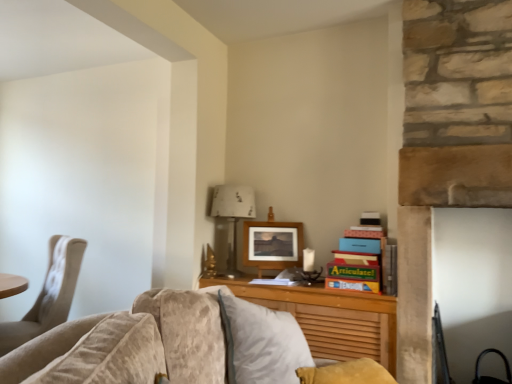
Question: From the image's perspective, is beige fabric chair at left located beneath wooden picture frame at center?

Choices:
 (A) yes
 (B) no

Answer: (A)

Question: Can you confirm if beige fabric chair at left is shorter than wooden picture frame at center?

Choices:
 (A) no
 (B) yes

Answer: (A)

Question: Is beige fabric chair at left facing away from wooden picture frame at center?

Choices:
 (A) yes
 (B) no

Answer: (B)

Question: Is beige fabric chair at left far from wooden picture frame at center?

Choices:
 (A) yes
 (B) no

Answer: (A)

Question: Considering the relative sizes of beige fabric chair at left and wooden picture frame at center in the image provided, is beige fabric chair at left smaller than wooden picture frame at center?

Choices:
 (A) yes
 (B) no

Answer: (B)

Question: From a real-world perspective, is metallic silver lamp at center positioned above or below wooden at center?

Choices:
 (A) above
 (B) below

Answer: (A)

Question: Is metallic silver lamp at center taller or shorter than wooden at center?

Choices:
 (A) short
 (B) tall

Answer: (B)

Question: Is point (233, 271) closer or farther from the camera than point (335, 339)?

Choices:
 (A) closer
 (B) farther

Answer: (B)

Question: Is metallic silver lamp at center spatially inside wooden at center, or outside of it?

Choices:
 (A) outside
 (B) inside

Answer: (A)

Question: From the image's perspective, is wooden picture frame at center positioned above or below wooden desk at center?

Choices:
 (A) above
 (B) below

Answer: (A)

Question: In the image, is wooden picture frame at center on the left side or the right side of wooden desk at center?

Choices:
 (A) left
 (B) right

Answer: (B)

Question: From a real-world perspective, relative to wooden desk at center, is wooden picture frame at center vertically above or below?

Choices:
 (A) above
 (B) below

Answer: (A)

Question: Is point (300, 244) positioned closer to the camera than point (344, 347)?

Choices:
 (A) closer
 (B) farther

Answer: (B)

Question: Based on their sizes in the image, would you say beige fabric chair at left is bigger or smaller than wooden picture frame at center?

Choices:
 (A) small
 (B) big

Answer: (B)

Question: From a real-world perspective, is beige fabric chair at left positioned above or below wooden picture frame at center?

Choices:
 (A) below
 (B) above

Answer: (A)